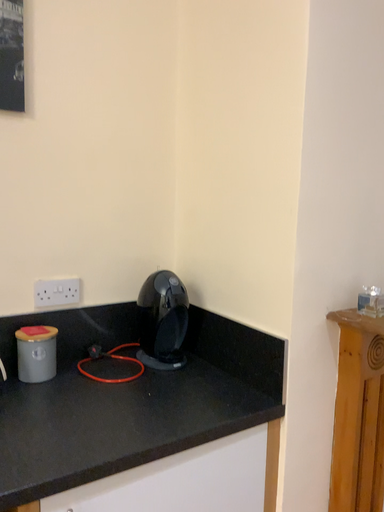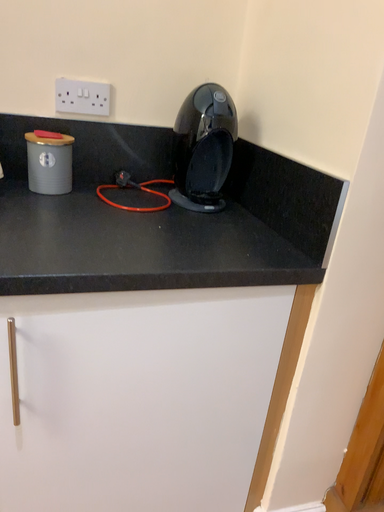
Question: Which way did the camera rotate in the video?

Choices:
 (A) rotated downward
 (B) rotated upward

Answer: (A)